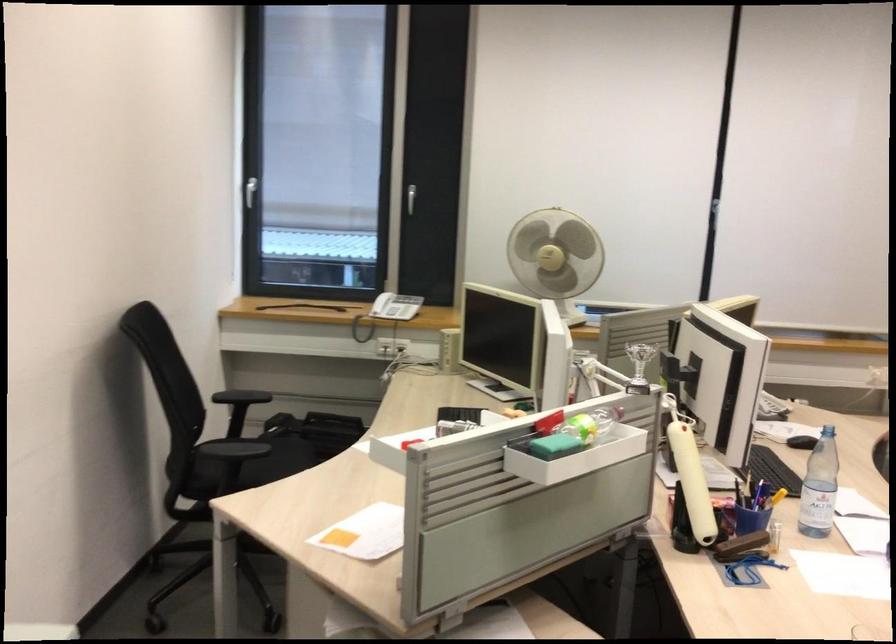
Where would you sit the chair sitting surface? Please return your answer as a coordinate pair (x, y).

(293, 453)